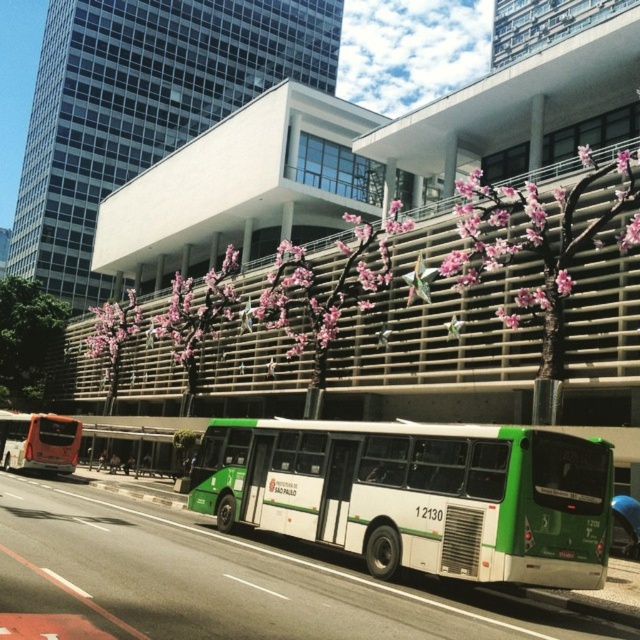
Which of these two, green matte bus at center or green leafy tree at lower left, stands taller?

With more height is green leafy tree at lower left.

This screenshot has height=640, width=640. Describe the element at coordinates (417, 493) in the screenshot. I see `green matte bus at center` at that location.

The height and width of the screenshot is (640, 640). I want to click on green matte bus at center, so click(417, 493).

Who is taller, green leafy tree at lower left or pink blossom tree at center?

green leafy tree at lower left is taller.

Does green leafy tree at lower left lie in front of pink blossom tree at center?

No, it is behind pink blossom tree at center.

The width and height of the screenshot is (640, 640). In order to click on green leafy tree at lower left in this screenshot , I will do `click(26, 339)`.

Who is more forward, [29,356] or [35,454]?

Positioned in front is point [35,454].

At what (x,y) coordinates should I click in order to perform the action: click on green leafy tree at lower left. Please return your answer as a coordinate pair (x, y). The width and height of the screenshot is (640, 640). Looking at the image, I should click on (26, 339).